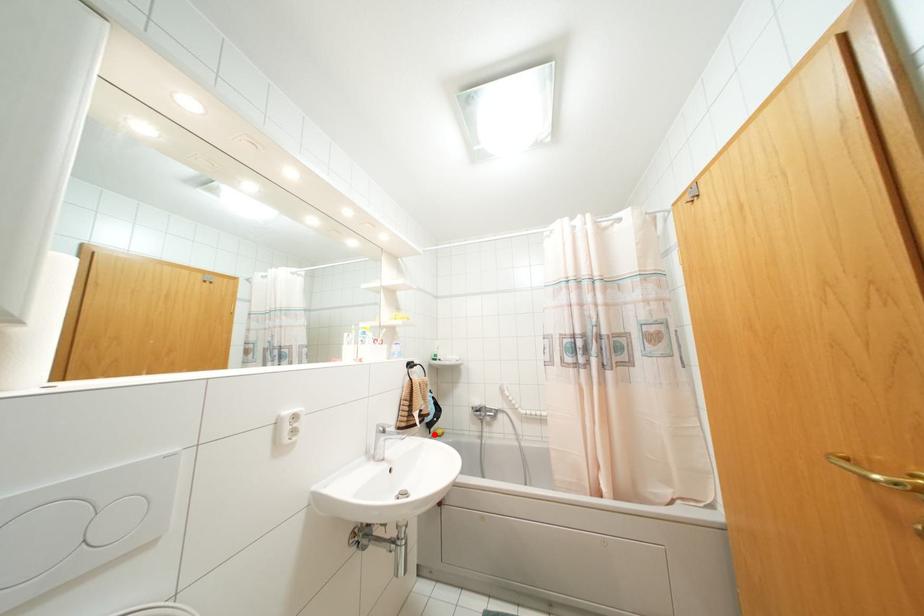
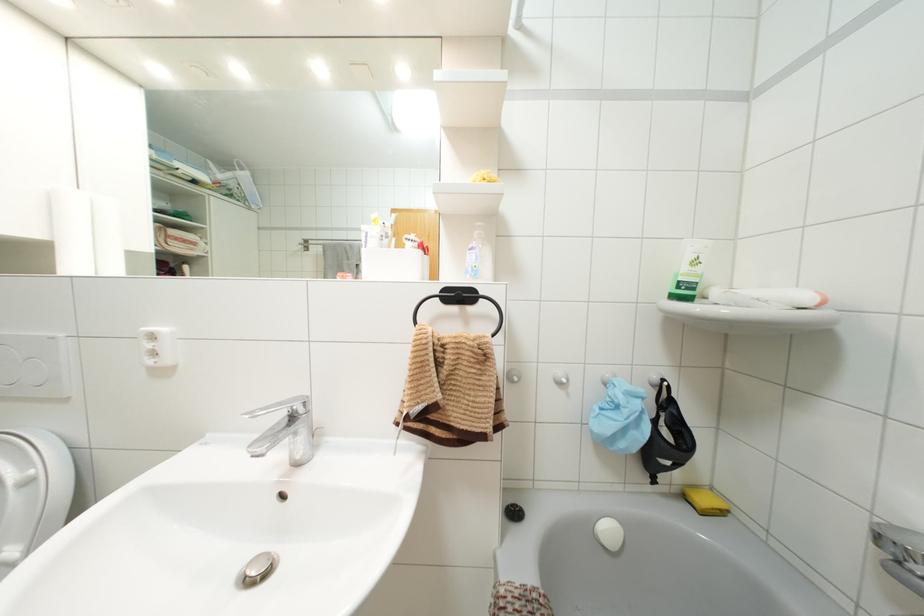
The point at the highlighted location is marked in the first image. Where is the corresponding point in the second image?

(685, 496)